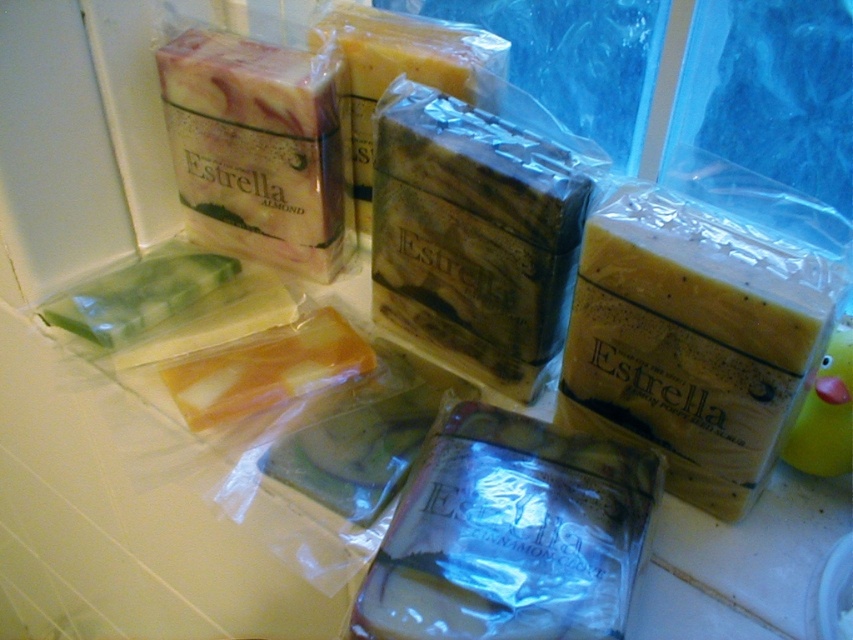
You are organizing a display of soaps on a bathroom countertop. You have the yellow matte soap at center and the translucent plastic soap at center. According to the image, which soap is positioned higher up?

The yellow matte soap at center is positioned higher up as it is located above the translucent plastic soap at center.

You are a customer at a store and want to pick up the yellow matte soap at center and the translucent plastic soap at center. The store requires that you must keep at least 6 inches apart between any two items you select to qualify for a discount. Based on the arrangement shown, will you qualify for the discount?

The distance between the yellow matte soap at center and the translucent plastic soap at center is 5.42 inches, which is less than the required 6 inches. Therefore, you will not qualify for the discount.

You are a customer in a store looking at the artisanal soaps displayed on the tiled bathroom countertop. You want to pick up the yellow matte soap at center. Based on its position coordinates, can you estimate where exactly it is located on the countertop?

The yellow matte soap at center is located at the coordinates point (695, 339) on the countertop.